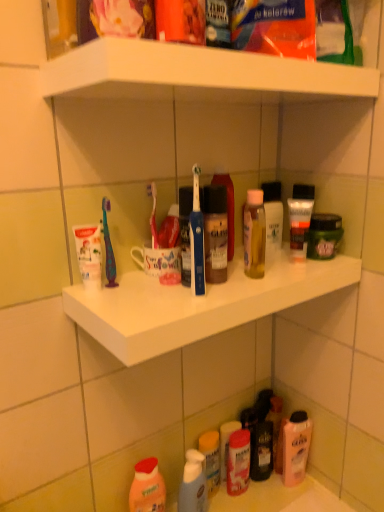
Where is `empty space that is ontop of translucent plastic bottles at lower center (from a real-world perspective)`? empty space that is ontop of translucent plastic bottles at lower center (from a real-world perspective) is located at coordinates click(243, 493).